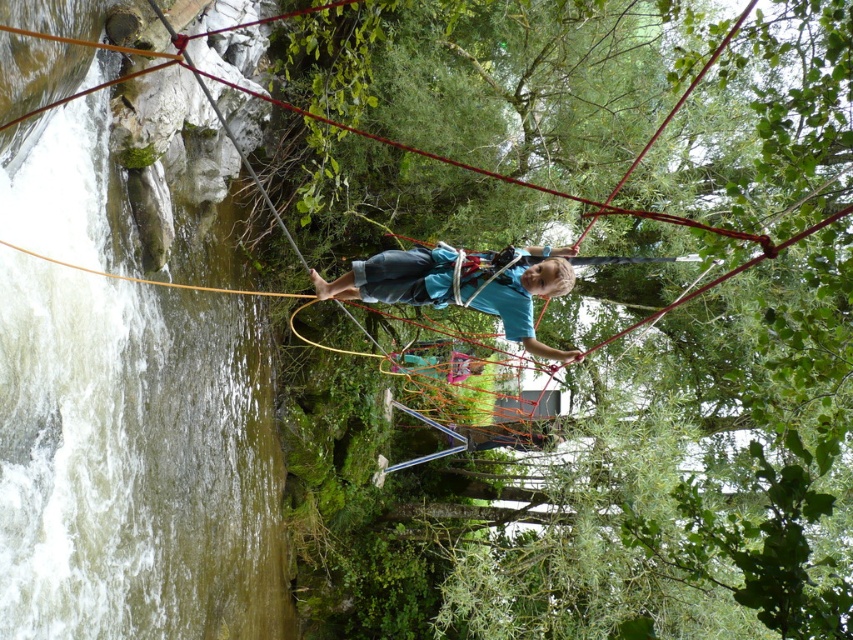
Consider the image. You are planning to cross the river using the objects in the scene. Which object, the rope bridge at center or the blue fabric at center, would provide a wider surface for walking?

The rope bridge at center might be wider than blue fabric at center, so it would provide a wider surface for walking.

You are a safety inspector checking the distance between the blue fabric shirt at center and the camera. According to the safety protocol, the minimum safe distance for such equipment is 5 meters. Is the current distance compliant?

The blue fabric shirt at center is 6.94 meters away from camera, which exceeds the minimum safe distance of 5 meters. Therefore, the current distance is compliant with safety protocols.